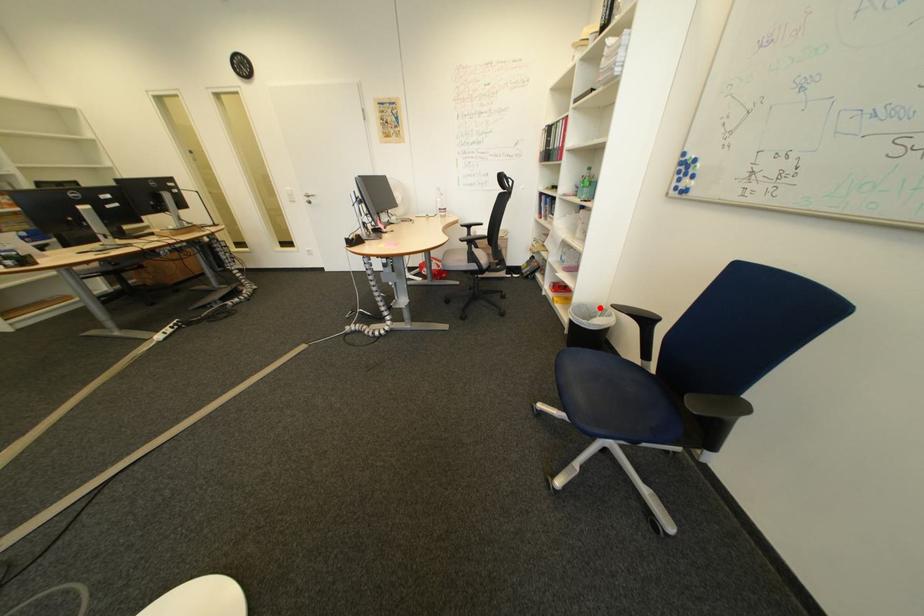
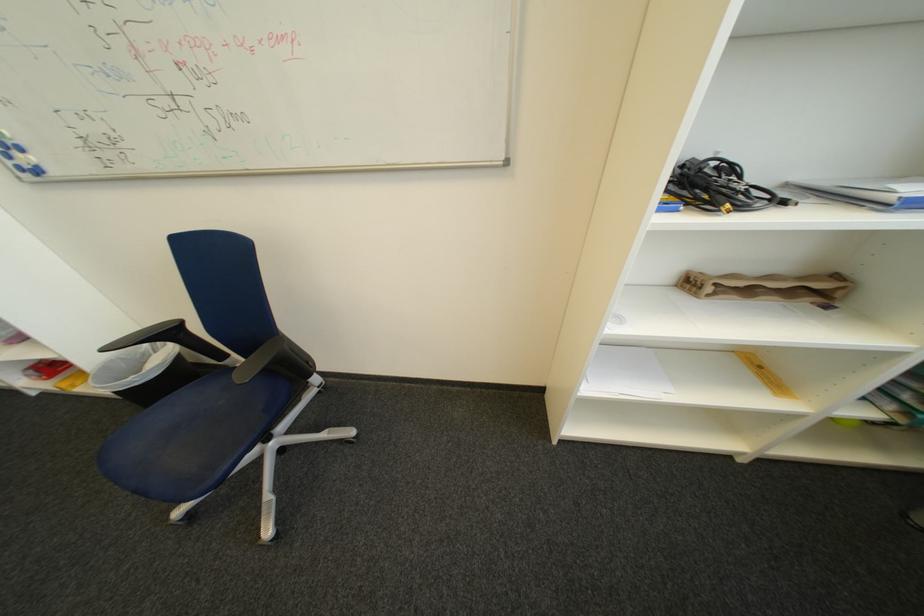
Find the pixel in the second image that matches the highlighted location in the first image.

(134, 360)